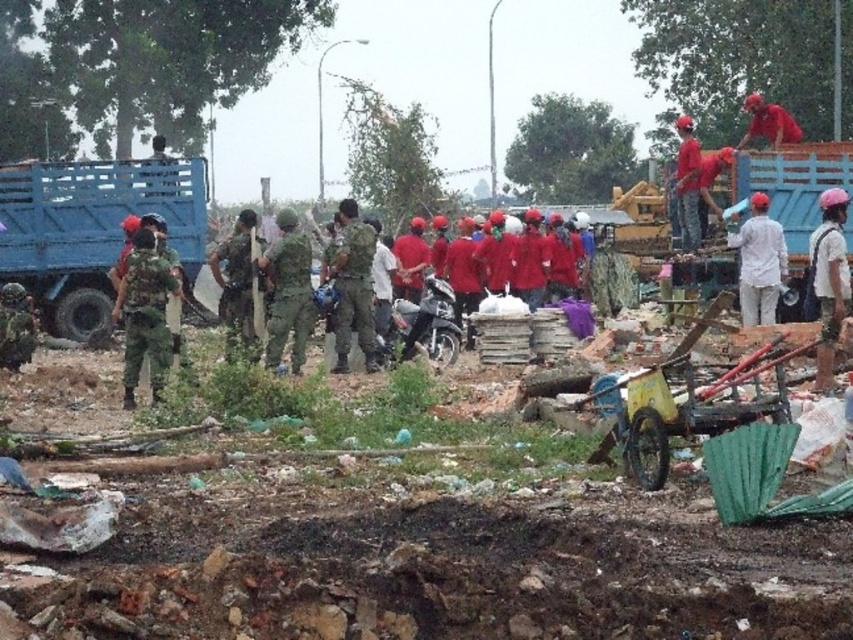
Which is in front, point (320, 243) or point (357, 330)?

Point (357, 330) is more forward.

Can you confirm if red matte uniform at center is shorter than camouflage fabric construction worker at center?

In fact, red matte uniform at center may be taller than camouflage fabric construction worker at center.

You are a GUI agent. You are given a task and a screenshot of the screen. Output one action in this format:
    pyautogui.click(x=<x>, y=<y>)
    Task: Click on the red matte uniform at center
    Image resolution: width=853 pixels, height=640 pixels.
    Given the screenshot: What is the action you would take?
    pyautogui.click(x=358, y=250)

Who is more forward, (277,241) or (751,300)?

Point (277,241)

The image size is (853, 640). I want to click on red matte uniform at center, so click(358, 250).

Locate an element on the screen. Image resolution: width=853 pixels, height=640 pixels. red matte uniform at center is located at coordinates (358, 250).

Consider the image. Is red matte uniform at center above red matte helmet at upper right?

Actually, red matte uniform at center is below red matte helmet at upper right.

Where is `red matte uniform at center`? The width and height of the screenshot is (853, 640). red matte uniform at center is located at coordinates (358, 250).